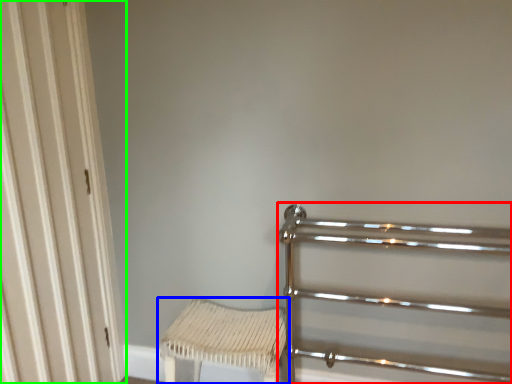
Question: Which object is positioned farthest from rail (highlighted by a red box)? Select from furniture (highlighted by a blue box) and door (highlighted by a green box).

Choices:
 (A) furniture
 (B) door

Answer: (B)